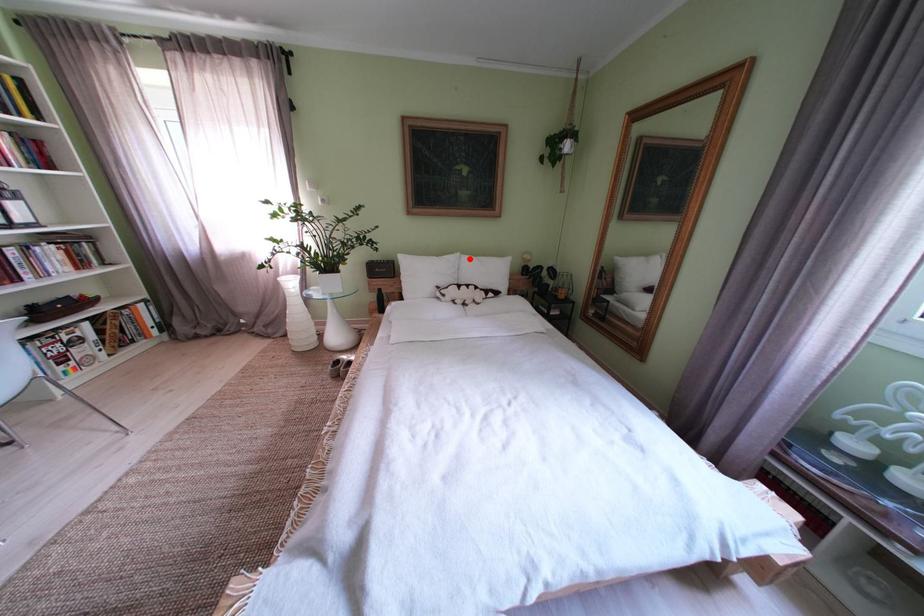
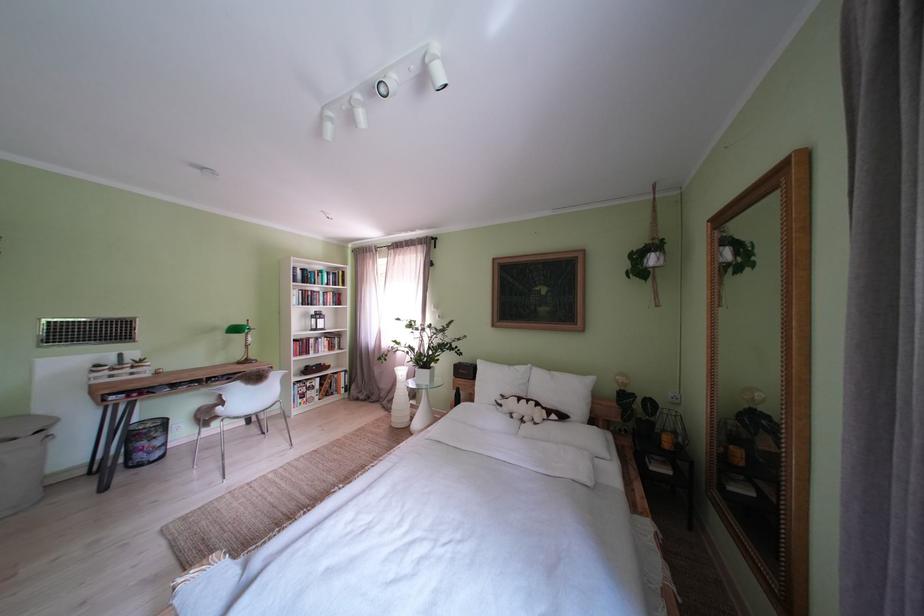
Locate, in the second image, the point that corresponds to the highlighted location in the first image.

(541, 371)